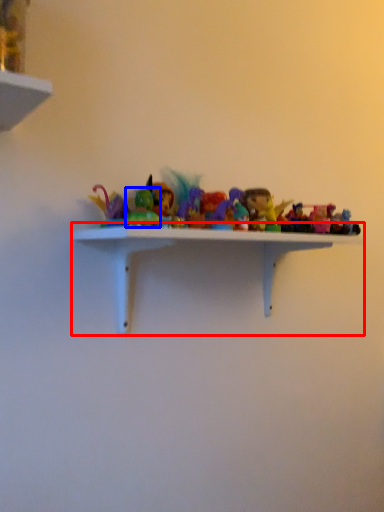
Question: Which point is further to the camera, shelf (highlighted by a red box) or toy (highlighted by a blue box)?

Choices:
 (A) shelf
 (B) toy

Answer: (B)